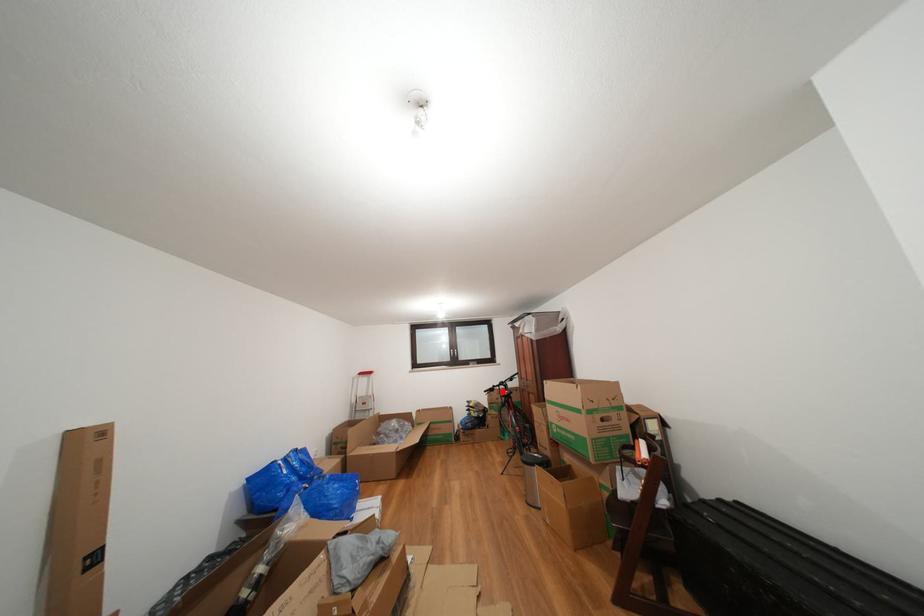
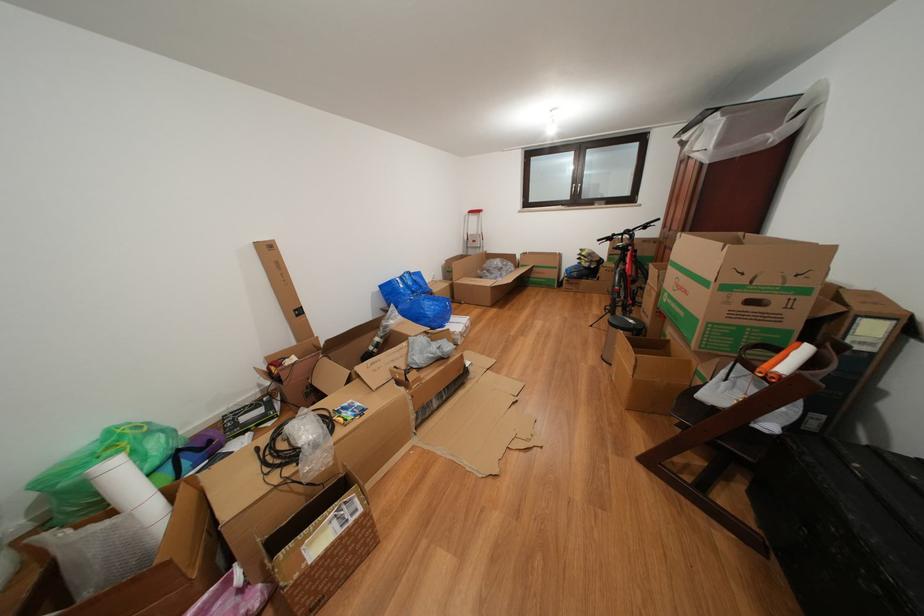
Question: I am providing you with two images of the same scene from different viewpoints. Given a red point in image1, look at the same physical point in image2. Is it:

Choices:
 (A) Closer to the viewpoint
 (B) Farther from the viewpoint

Answer: (A)